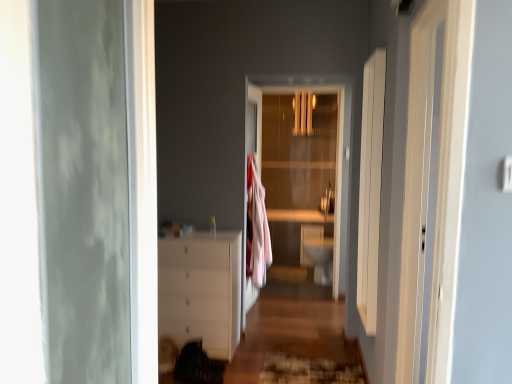
Find the location of a particular element. free space to the back side of transparent glass door at center is located at coordinates (290, 283).